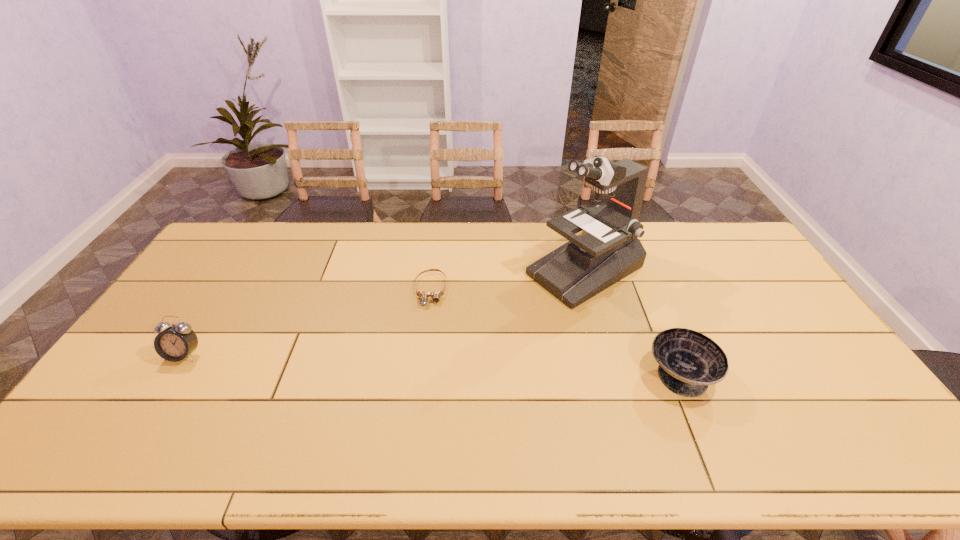
You are a GUI agent. You are given a task and a screenshot of the screen. Output one action in this format:
    pyautogui.click(x=<x>, y=<y>)
    Task: Click on the leftmost object
    This screenshot has height=540, width=960.
    Given the screenshot: What is the action you would take?
    pyautogui.click(x=177, y=342)

You are a GUI agent. You are given a task and a screenshot of the screen. Output one action in this format:
    pyautogui.click(x=<x>, y=<y>)
    Task: Click on the third shortest object
    Image resolution: width=960 pixels, height=540 pixels.
    Given the screenshot: What is the action you would take?
    pyautogui.click(x=177, y=342)

Find the location of a particular element. bowl is located at coordinates (689, 361).

Where is `the tallest object`? The image size is (960, 540). the tallest object is located at coordinates (608, 249).

This screenshot has width=960, height=540. Find the location of `the second object from left to right`. the second object from left to right is located at coordinates (436, 295).

At what (x,y) coordinates should I click in order to perform the action: click on the shortest object. Please return your answer as a coordinate pair (x, y). This screenshot has height=540, width=960. Looking at the image, I should click on (436, 295).

This screenshot has height=540, width=960. In order to click on vacant space situated on the face of the alarm clock in this screenshot , I will do `click(149, 411)`.

In order to click on free space located 0.120m on the back of the bowl in this screenshot , I will do `click(657, 317)`.

You are a GUI agent. You are given a task and a screenshot of the screen. Output one action in this format:
    pyautogui.click(x=<x>, y=<y>)
    Task: Click on the vacant space positioned 0.310m through the eyepieces of the microscope
    
    Given the screenshot: What is the action you would take?
    pyautogui.click(x=463, y=336)

Locate an element on the screen. The image size is (960, 540). blank space located 0.180m through the eyepieces of the microscope is located at coordinates (497, 317).